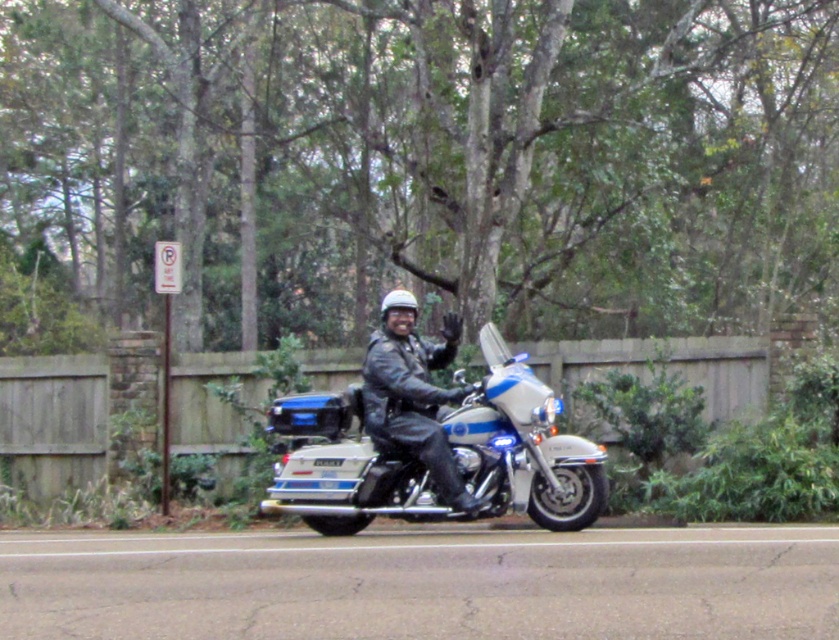
Who is lower down, shiny chrome motorcycle at center or matte black leather jacket at center?

shiny chrome motorcycle at center

Is shiny chrome motorcycle at center smaller than matte black leather jacket at center?

No, shiny chrome motorcycle at center is not smaller than matte black leather jacket at center.

Describe the element at coordinates (522, 445) in the screenshot. I see `shiny chrome motorcycle at center` at that location.

You are a GUI agent. You are given a task and a screenshot of the screen. Output one action in this format:
    pyautogui.click(x=<x>, y=<y>)
    Task: Click on the shiny chrome motorcycle at center
    This screenshot has width=839, height=640.
    Given the screenshot: What is the action you would take?
    pyautogui.click(x=522, y=445)

Which is behind, point (243, 84) or point (491, 445)?

The point (243, 84) is more distant.

Who is more distant from viewer, (638, 150) or (284, 467)?

The point (638, 150) is more distant.

Where is `green leafy tree at center`? The height and width of the screenshot is (640, 839). green leafy tree at center is located at coordinates (425, 160).

Does green leafy tree at center appear over matte black leather jacket at center?

Correct, green leafy tree at center is located above matte black leather jacket at center.

Who is positioned more to the right, green leafy tree at center or matte black leather jacket at center?

matte black leather jacket at center is more to the right.

Image resolution: width=839 pixels, height=640 pixels. I want to click on green leafy tree at center, so [425, 160].